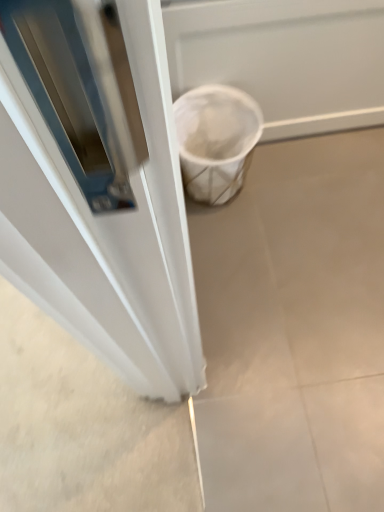
What are the coordinates of `free spot above white matte trash can at lower right (from a real-world perspective)` in the screenshot? It's located at (300, 287).